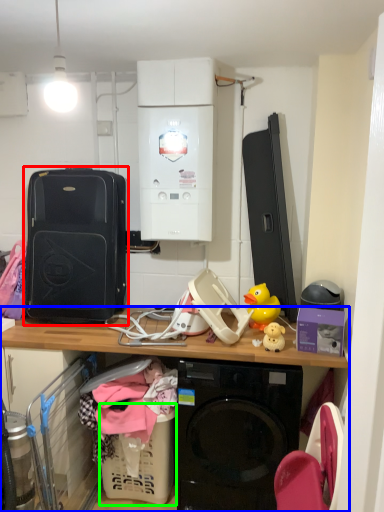
Question: Which is nearer to the luggage and bags (highlighted by a red box)? desk (highlighted by a blue box) or basket (highlighted by a green box).

Choices:
 (A) desk
 (B) basket

Answer: (A)